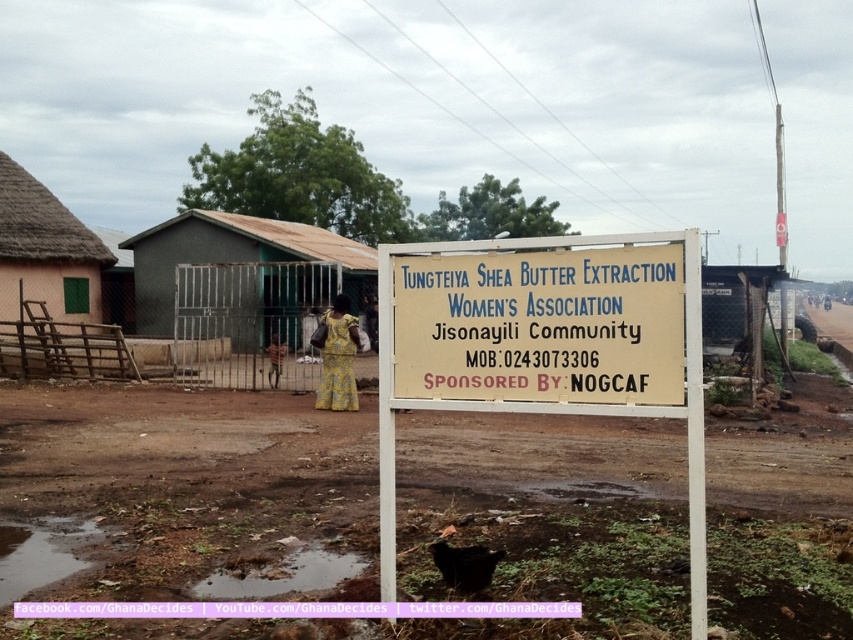
Which is above, green corrugated metal hut at center or thatched straw hut at left?

Positioned higher is thatched straw hut at left.

The image size is (853, 640). I want to click on green corrugated metal hut at center, so click(231, 257).

Locate an element on the screen. This screenshot has width=853, height=640. green corrugated metal hut at center is located at coordinates (231, 257).

Is green corrugated metal hut at center thinner than black matte animal at center?

No.

Can you confirm if green corrugated metal hut at center is wider than black matte animal at center?

Yes.

Is point (158, 237) more distant than point (462, 560)?

Yes.

You are a GUI agent. You are given a task and a screenshot of the screen. Output one action in this format:
    pyautogui.click(x=<x>, y=<y>)
    Task: Click on the green corrugated metal hut at center
    The height and width of the screenshot is (640, 853).
    Given the screenshot: What is the action you would take?
    pyautogui.click(x=231, y=257)

Is white plastic sign at center smaller than black matte animal at center?

No.

At what (x,y) coordinates should I click in order to perform the action: click on white plastic sign at center. Please return your answer as a coordinate pair (x, y). Looking at the image, I should click on pyautogui.click(x=544, y=346).